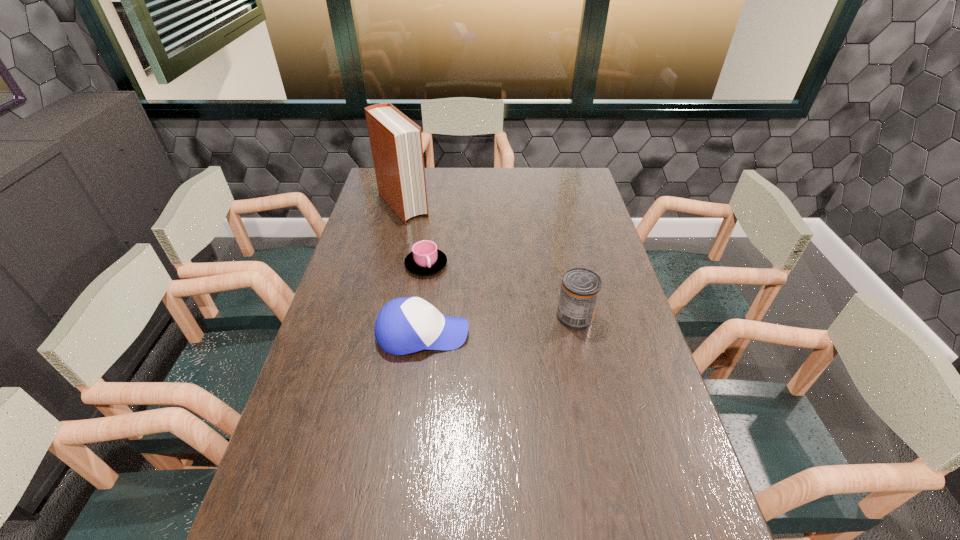
The height and width of the screenshot is (540, 960). Identify the location of the third tallest object. (404, 325).

This screenshot has width=960, height=540. I want to click on can, so click(x=580, y=289).

This screenshot has height=540, width=960. I want to click on the second tallest object, so pyautogui.click(x=580, y=289).

The width and height of the screenshot is (960, 540). Find the location of `the farthest object`. the farthest object is located at coordinates (396, 142).

The height and width of the screenshot is (540, 960). In order to click on hardback book in this screenshot , I will do `click(396, 142)`.

The width and height of the screenshot is (960, 540). Find the location of `the shortest object`. the shortest object is located at coordinates (425, 259).

Where is `cup`? cup is located at coordinates (425, 259).

In order to click on free space located 0.220m on the front-facing side of the third tallest object in this screenshot , I will do coord(545,334).

Image resolution: width=960 pixels, height=540 pixels. Identify the location of free space located on the back of the third shortest object. point(568,284).

You are a GUI agent. You are given a task and a screenshot of the screen. Output one action in this format:
    pyautogui.click(x=<x>, y=<y>)
    Task: Click on the vacant space located on the open cover of the farthest object
    The width and height of the screenshot is (960, 540).
    Given the screenshot: What is the action you would take?
    pyautogui.click(x=447, y=259)